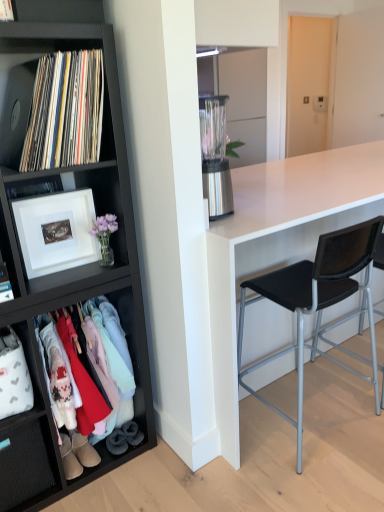
At what (x,y) coordinates should I click in order to perform the action: click on unoccupied region to the right of stainless steel blender at center. Please return your answer as a coordinate pair (x, y). This screenshot has height=512, width=384. Looking at the image, I should click on (257, 210).